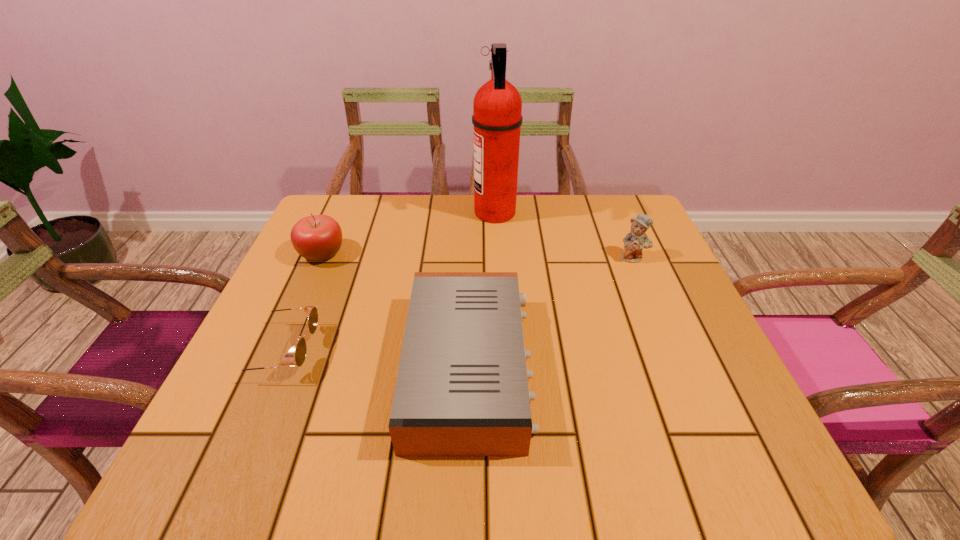
Find the location of a particular element. This screenshot has width=960, height=540. vacant area that lies between the tallest object and the apple is located at coordinates (408, 233).

This screenshot has width=960, height=540. Find the location of `vacant region between the apple and the tallest object`. vacant region between the apple and the tallest object is located at coordinates (408, 233).

The image size is (960, 540). I want to click on object identified as the third closest to the rightmost object, so click(319, 237).

The height and width of the screenshot is (540, 960). I want to click on object that is the third closest to the shortest object, so click(x=497, y=106).

Locate an element on the screen. The width and height of the screenshot is (960, 540). free region that satisfies the following two spatial constraints: 1. on the front-facing side of the rightmost object; 2. on the front lenses of the sunglasses is located at coordinates (672, 352).

Image resolution: width=960 pixels, height=540 pixels. Identify the location of free space that satisfies the following two spatial constraints: 1. on the front-facing side of the teddy bear; 2. on the control panel of the radio receiver. (679, 367).